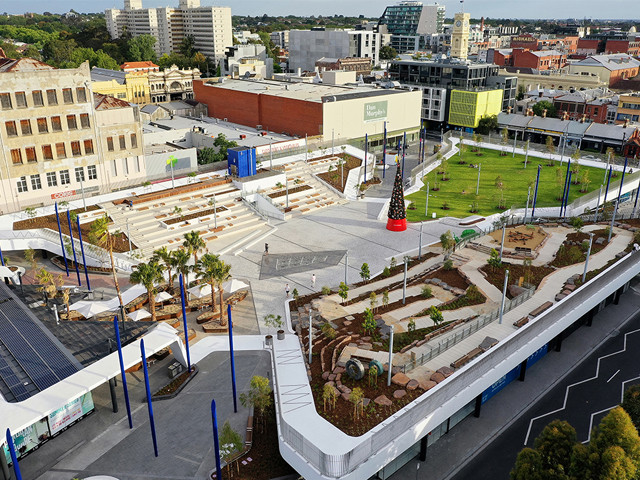
At what (x,y) coordinates should I click in order to perform the action: click on decorative stones. Please return your answer as a coordinate pair (x, y). Looking at the image, I should click on (385, 400), (403, 380), (444, 371).